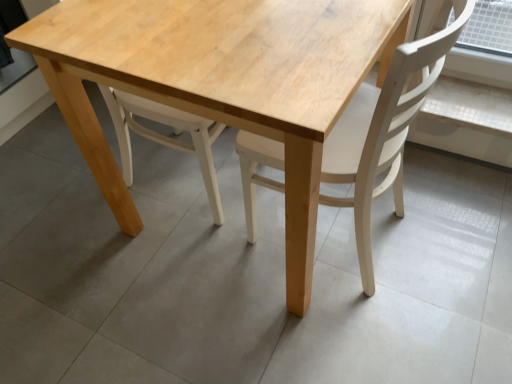
Locate an element on the screen. The image size is (512, 384). vacant area in front of light wood chair at center is located at coordinates (367, 334).